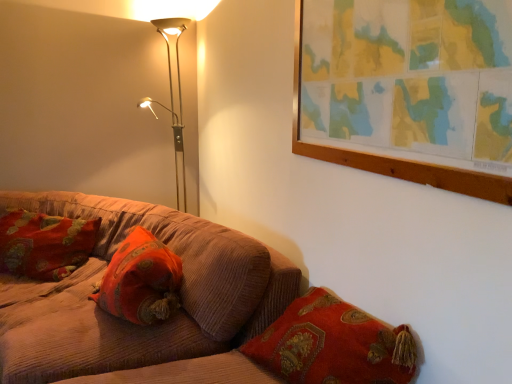
Question: Should I look upward or downward to see velvet orange pillow at center, which is the 2th pillow in back-to-front order?

Choices:
 (A) down
 (B) up

Answer: (A)

Question: Is velvet orange pillow at center, marked as the second pillow in a left-to-right arrangement, wider than metallic floor lamp at upper left?

Choices:
 (A) yes
 (B) no

Answer: (B)

Question: Does velvet orange pillow at center, the first pillow in the right-to-left sequence, have a smaller size compared to metallic floor lamp at upper left?

Choices:
 (A) no
 (B) yes

Answer: (B)

Question: Is velvet orange pillow at center, arranged as the first pillow when viewed from the front, oriented away from metallic floor lamp at upper left?

Choices:
 (A) yes
 (B) no

Answer: (B)

Question: From a real-world perspective, is velvet orange pillow at center, marked as the second pillow in a left-to-right arrangement, physically below metallic floor lamp at upper left?

Choices:
 (A) yes
 (B) no

Answer: (A)

Question: Is velvet orange pillow at center, the first pillow in the right-to-left sequence, to the left of metallic floor lamp at upper left from the viewer's perspective?

Choices:
 (A) no
 (B) yes

Answer: (A)

Question: From the image's perspective, does velvet orange pillow at center, marked as the second pillow in a left-to-right arrangement, appear lower than metallic floor lamp at upper left?

Choices:
 (A) yes
 (B) no

Answer: (A)

Question: Is metallic floor lamp at upper left further to the viewer compared to velvet cushion at left, placed as the 1th pillow when sorted from left to right?

Choices:
 (A) no
 (B) yes

Answer: (B)

Question: Does metallic floor lamp at upper left have a greater width compared to velvet cushion at left, arranged as the 1th pillow when viewed from the back?

Choices:
 (A) yes
 (B) no

Answer: (A)

Question: Can you confirm if metallic floor lamp at upper left is smaller than velvet cushion at left, placed as the second pillow when sorted from front to back?

Choices:
 (A) no
 (B) yes

Answer: (A)

Question: Is metallic floor lamp at upper left surrounding velvet cushion at left, arranged as the 1th pillow when viewed from the back?

Choices:
 (A) no
 (B) yes

Answer: (A)

Question: Considering the relative positions of metallic floor lamp at upper left and velvet cushion at left, placed as the 1th pillow when sorted from left to right, in the image provided, is metallic floor lamp at upper left in front of velvet cushion at left, placed as the 1th pillow when sorted from left to right,?

Choices:
 (A) yes
 (B) no

Answer: (B)

Question: Is there a large distance between metallic floor lamp at upper left and velvet cushion at left, arranged as the second pillow when viewed from the right?

Choices:
 (A) yes
 (B) no

Answer: (A)

Question: Is velvet orange pillow at center, marked as the second pillow in a left-to-right arrangement, thinner than corduroy couch at lower left?

Choices:
 (A) yes
 (B) no

Answer: (A)